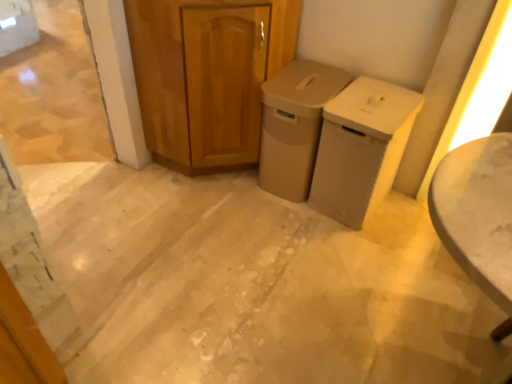
Question: Can we say beige textured waste bin at center-right, positioned as the first waste container in right-to-left order, lies outside wooden cabinet at center?

Choices:
 (A) no
 (B) yes

Answer: (B)

Question: Is beige textured waste bin at center-right, positioned as the first waste container in right-to-left order, at the right side of wooden cabinet at center?

Choices:
 (A) yes
 (B) no

Answer: (A)

Question: From the image's perspective, does beige textured waste bin at center-right, positioned as the first waste container in right-to-left order, appear lower than wooden cabinet at center?

Choices:
 (A) yes
 (B) no

Answer: (A)

Question: From the image's perspective, does beige textured waste bin at center-right, positioned as the first waste container in right-to-left order, appear higher than wooden cabinet at center?

Choices:
 (A) yes
 (B) no

Answer: (B)

Question: From a real-world perspective, is beige textured waste bin at center-right, acting as the second waste container starting from the left, positioned over wooden cabinet at center based on gravity?

Choices:
 (A) yes
 (B) no

Answer: (B)

Question: Are beige textured waste bin at center-right, acting as the second waste container starting from the left, and wooden cabinet at center making contact?

Choices:
 (A) no
 (B) yes

Answer: (A)

Question: From a real-world perspective, is wooden cabinet at center located higher than beige textured waste bin at center-right, positioned as the first waste container in right-to-left order?

Choices:
 (A) yes
 (B) no

Answer: (A)

Question: From a real-world perspective, is wooden cabinet at center positioned under beige textured waste bin at center-right, acting as the second waste container starting from the left, based on gravity?

Choices:
 (A) no
 (B) yes

Answer: (A)

Question: Could you tell me if wooden cabinet at center is turned towards beige textured waste bin at center-right, positioned as the first waste container in right-to-left order?

Choices:
 (A) yes
 (B) no

Answer: (A)

Question: Is wooden cabinet at center taller than beige textured waste bin at center-right, acting as the second waste container starting from the left?

Choices:
 (A) yes
 (B) no

Answer: (A)

Question: Can you confirm if wooden cabinet at center is bigger than beige textured waste bin at center-right, positioned as the first waste container in right-to-left order?

Choices:
 (A) yes
 (B) no

Answer: (A)

Question: Considering the relative sizes of wooden cabinet at center and beige textured waste bin at center-right, acting as the second waste container starting from the left, in the image provided, is wooden cabinet at center shorter than beige textured waste bin at center-right, acting as the second waste container starting from the left,?

Choices:
 (A) no
 (B) yes

Answer: (A)

Question: Is beige matte trash can at center, positioned as the 2th waste container in right-to-left order, positioned beyond the bounds of wooden cabinet at center?

Choices:
 (A) no
 (B) yes

Answer: (B)